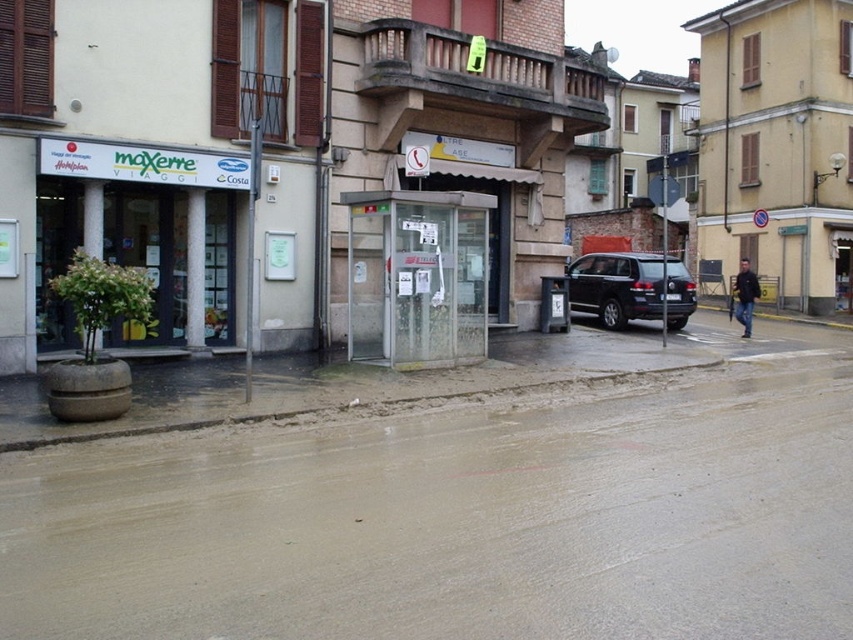
Which is more to the right, transparent glass booth at center or white glossy signboard at upper left?

Positioned to the right is transparent glass booth at center.

The height and width of the screenshot is (640, 853). Describe the element at coordinates (416, 276) in the screenshot. I see `transparent glass booth at center` at that location.

At what (x,y) coordinates should I click in order to perform the action: click on transparent glass booth at center. Please return your answer as a coordinate pair (x, y). Looking at the image, I should click on (416, 276).

Identify the location of transparent glass booth at center. (416, 276).

Where is `transparent glass booth at center`? The height and width of the screenshot is (640, 853). transparent glass booth at center is located at coordinates (416, 276).

Who is shorter, transparent glass booth at center or dark blue jacket at lower right?

With less height is dark blue jacket at lower right.

Image resolution: width=853 pixels, height=640 pixels. I want to click on transparent glass booth at center, so [x=416, y=276].

Identify the location of black matte suv at center. (616, 285).

Can you confirm if black matte suv at center is positioned to the left of dark blue jacket at lower right?

Correct, you'll find black matte suv at center to the left of dark blue jacket at lower right.

Is point (654, 275) positioned before point (740, 316)?

No, it is behind (740, 316).

Where is `black matte suv at center`? black matte suv at center is located at coordinates (616, 285).